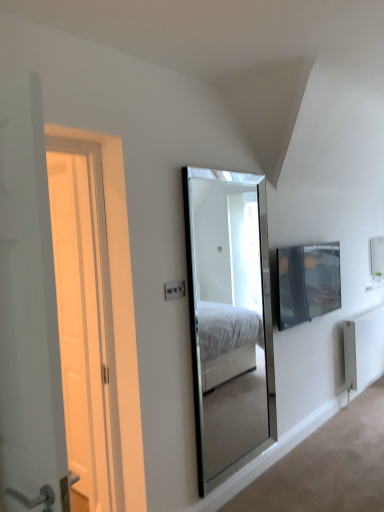
Question: From a real-world perspective, is white wooden door at left positioned under white plastic electric outlet at center based on gravity?

Choices:
 (A) no
 (B) yes

Answer: (A)

Question: Can you confirm if white wooden door at left is smaller than white plastic electric outlet at center?

Choices:
 (A) yes
 (B) no

Answer: (B)

Question: Does white wooden door at left contain white plastic electric outlet at center?

Choices:
 (A) no
 (B) yes

Answer: (A)

Question: Is white wooden door at left looking in the opposite direction of white plastic electric outlet at center?

Choices:
 (A) no
 (B) yes

Answer: (A)

Question: Would you consider white wooden door at left to be distant from white plastic electric outlet at center?

Choices:
 (A) no
 (B) yes

Answer: (B)

Question: Are white wooden door at left and white plastic electric outlet at center beside each other?

Choices:
 (A) no
 (B) yes

Answer: (A)

Question: Does matte black tv at right contain white wooden door at left?

Choices:
 (A) no
 (B) yes

Answer: (A)

Question: From a real-world perspective, is matte black tv at right on top of white wooden door at left?

Choices:
 (A) yes
 (B) no

Answer: (B)

Question: Can we say matte black tv at right lies outside white wooden door at left?

Choices:
 (A) yes
 (B) no

Answer: (A)

Question: Is matte black tv at right wider than white wooden door at left?

Choices:
 (A) no
 (B) yes

Answer: (A)

Question: Is matte black tv at right taller than white wooden door at left?

Choices:
 (A) no
 (B) yes

Answer: (A)

Question: Is matte black tv at right at the right side of white wooden door at left?

Choices:
 (A) no
 (B) yes

Answer: (B)

Question: Is white wooden door at left to the right of white metallic radiator at lower right from the viewer's perspective?

Choices:
 (A) no
 (B) yes

Answer: (A)